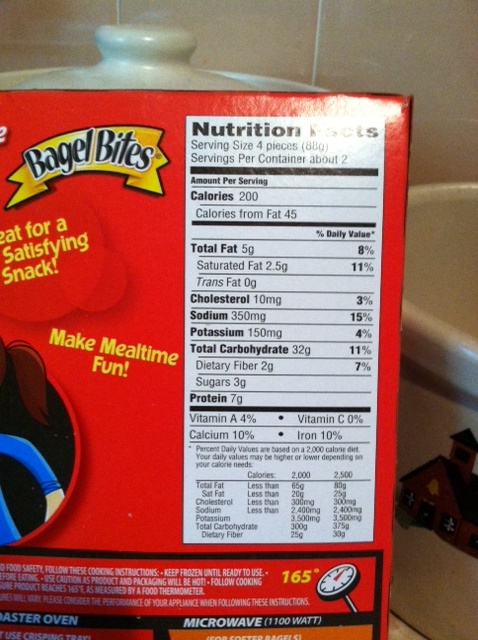
This screenshot has width=478, height=640. Identify the location of jars. (168, 580), (422, 216).